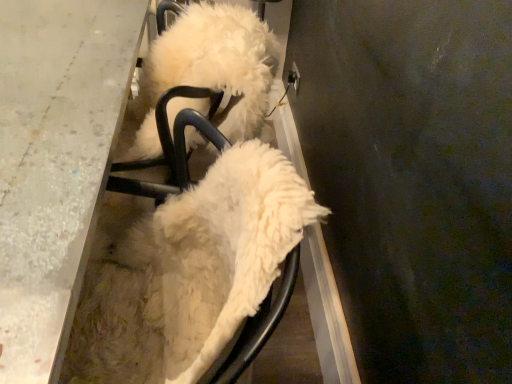
The height and width of the screenshot is (384, 512). What do you see at coordinates (55, 161) in the screenshot?
I see `white glossy table at left` at bounding box center [55, 161].

Measure the distance between white glossy table at left and camera.

They are 38.47 centimeters apart.

Find the location of `white glossy table at left`. white glossy table at left is located at coordinates (55, 161).

The height and width of the screenshot is (384, 512). Describe the element at coordinates (189, 272) in the screenshot. I see `white fluffy dog at center` at that location.

Find the location of a particular element. white fluffy dog at center is located at coordinates (189, 272).

Find the location of a particular element. white glossy table at left is located at coordinates (55, 161).

Considering the relative positions of white glossy table at left and white fluffy dog at center in the image provided, is white glossy table at left to the left of white fluffy dog at center from the viewer's perspective?

Correct, you'll find white glossy table at left to the left of white fluffy dog at center.

Is white glossy table at left further to the viewer compared to white fluffy dog at center?

Yes, it is.

Which is farther from the camera, (3, 29) or (194, 312)?

The point (3, 29) is farther from the camera.

Looking at this image, from the image's perspective, who appears lower, white glossy table at left or white fluffy dog at center?

white fluffy dog at center appears lower in the image.

From a real-world perspective, which object rests below the other?

white glossy table at left.

Is white glossy table at left wider or thinner than white fluffy dog at center?

Clearly, white glossy table at left has less width compared to white fluffy dog at center.

In terms of height, does white glossy table at left look taller or shorter compared to white fluffy dog at center?

white glossy table at left is shorter than white fluffy dog at center.

In terms of size, does white glossy table at left appear bigger or smaller than white fluffy dog at center?

white glossy table at left is bigger than white fluffy dog at center.

Is white fluffy dog at center a part of white glossy table at left?

Indeed, white fluffy dog at center is located within white glossy table at left.

Are white glossy table at left and white fluffy dog at center beside each other?

No, white glossy table at left is not beside white fluffy dog at center.

Does white glossy table at left turn towards white fluffy dog at center?

No, white glossy table at left is not facing towards white fluffy dog at center.

Consider the image. Can you tell me how much white glossy table at left and white fluffy dog at center differ in facing direction?

The facing directions of white glossy table at left and white fluffy dog at center are 0.92 degrees apart.

You are a GUI agent. You are given a task and a screenshot of the screen. Output one action in this format:
    pyautogui.click(x=<x>, y=<y>)
    Task: Click on the table lying above the white fluffy dog at center (from the image's perspective)
    
    Given the screenshot: What is the action you would take?
    pyautogui.click(x=55, y=161)

Which is more to the left, white fluffy dog at center or white glossy table at left?

Positioned to the left is white glossy table at left.

From the picture: Which is behind, white fluffy dog at center or white glossy table at left?

white glossy table at left is further away from the camera.

Considering the positions of point (217, 288) and point (16, 378), is point (217, 288) closer or farther from the camera than point (16, 378)?

Point (217, 288) appears to be farther away from the viewer than point (16, 378).

From the image's perspective, is white fluffy dog at center under white glossy table at left?

Indeed, from the image's perspective, white fluffy dog at center is shown beneath white glossy table at left.

From a real-world perspective, between white fluffy dog at center and white glossy table at left, who is vertically lower?

white glossy table at left is physically lower.

Between white fluffy dog at center and white glossy table at left, which one has smaller width?

white glossy table at left is thinner.

Does white fluffy dog at center have a lesser height compared to white glossy table at left?

No.

Between white fluffy dog at center and white glossy table at left, which one has larger size?

With larger size is white glossy table at left.

Is white glossy table at left a part of white fluffy dog at center?

No, white fluffy dog at center does not contain white glossy table at left.

Is white fluffy dog at center far from white glossy table at left?

They are positioned close to each other.

Is white fluffy dog at center looking in the opposite direction of white glossy table at left?

Yes, white fluffy dog at center's orientation is away from white glossy table at left.

The image size is (512, 384). What are the coordinates of `dog in front of the white glossy table at left` in the screenshot? It's located at (189, 272).

At what (x,y) coordinates should I click in order to perform the action: click on table that appears above the white fluffy dog at center (from the image's perspective). Please return your answer as a coordinate pair (x, y). Looking at the image, I should click on (55, 161).

Image resolution: width=512 pixels, height=384 pixels. Find the location of `dog in front of the white glossy table at left`. dog in front of the white glossy table at left is located at coordinates (189, 272).